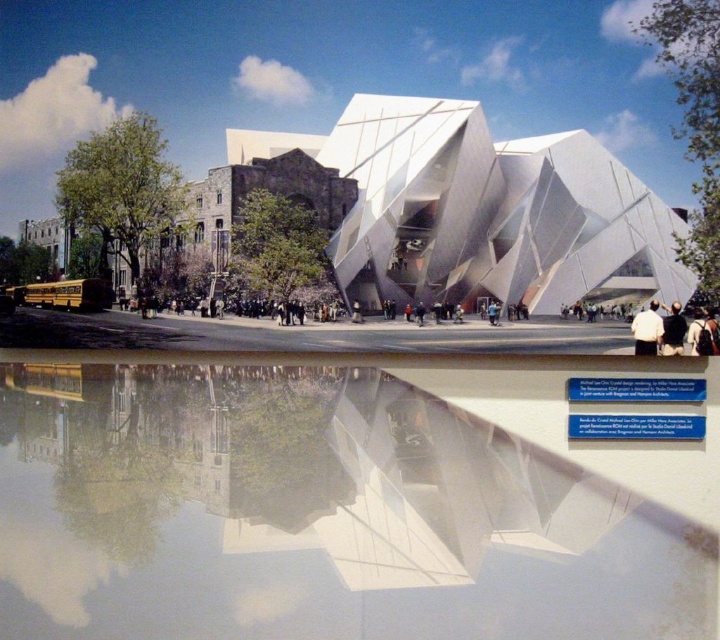
You are standing in the scene and want to find the white matte shirt at center. Based on the coordinates, where would you look relative to the bottom edge of the image?

The white matte shirt at center is located at point 0.516 along the horizontal axis and 0.900 along the vertical axis, meaning it is positioned near the bottom edge of the image, approximately 90.000 percent from the bottom. Since the vertical coordinate is 0.900, it is closer to the bottom edge, so you should look near the bottom of the image.

You are standing at point A which is at coordinate (315, 515). You want to walk to the modern building. Which direction should you move? North, South, East, or West?

You should move North because the point is on transparent glass water at center, and the modern building is in front of it, so north would be towards the building.